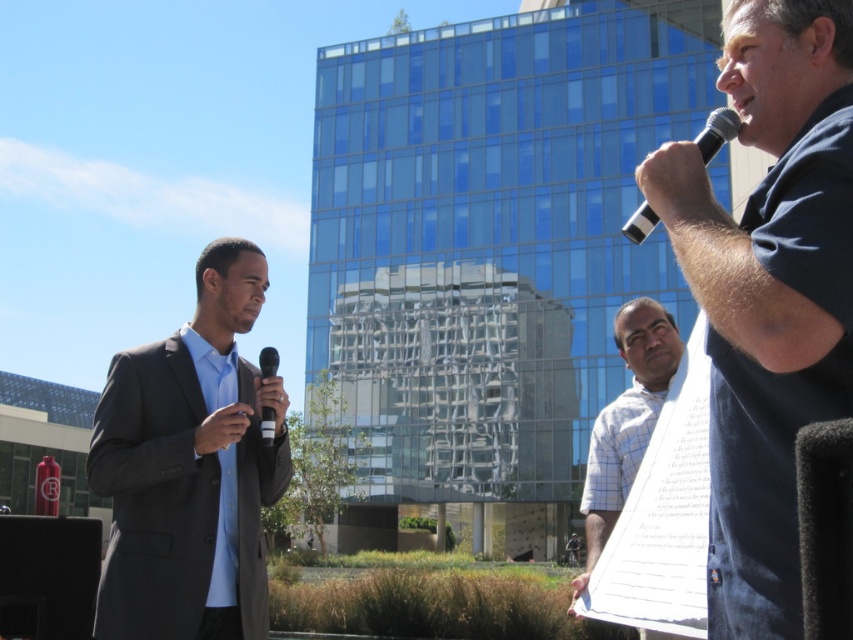
Question: Among these points, which one is farthest from the camera?

Choices:
 (A) (634, 221)
 (B) (39, 634)

Answer: (B)

Question: Is dark blue t-shirt at right bigger than dark gray suit at left?

Choices:
 (A) yes
 (B) no

Answer: (B)

Question: Among these points, which one is nearest to the camera?

Choices:
 (A) (640, 205)
 (B) (625, 333)
 (C) (30, 524)

Answer: (C)

Question: Is black plastic microphone at upper right below black matte microphone at center?

Choices:
 (A) yes
 (B) no

Answer: (B)

Question: Which point is closer to the camera?

Choices:
 (A) pos(67,544)
 (B) pos(672,369)
 (C) pos(270,369)

Answer: (C)

Question: Does matte black microphone at lower left appear on the left side of black matte microphone at center?

Choices:
 (A) no
 (B) yes

Answer: (B)